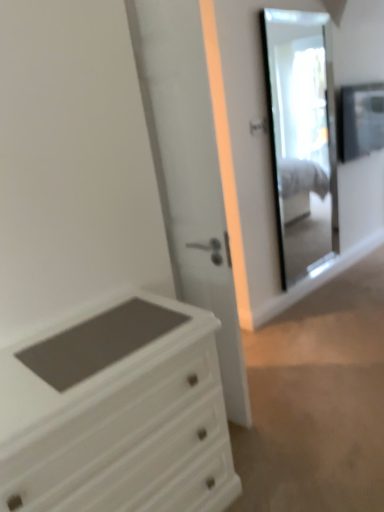
Question: Considering their positions, is clear glass mirror at upper right located in front of or behind matte black frame at upper right?

Choices:
 (A) front
 (B) behind

Answer: (A)

Question: From a real-world perspective, is clear glass mirror at upper right positioned above or below matte black frame at upper right?

Choices:
 (A) below
 (B) above

Answer: (A)

Question: Estimate the real-world distances between objects in this image. Which object is closer to the clear glass mirror at upper right?

Choices:
 (A) white glossy door at center
 (B) matte black frame at upper right
 (C) white wood chest of drawers at lower left

Answer: (B)

Question: Which is farther from the matte black frame at upper right?

Choices:
 (A) clear glass mirror at upper right
 (B) white wood chest of drawers at lower left
 (C) white glossy door at center

Answer: (B)